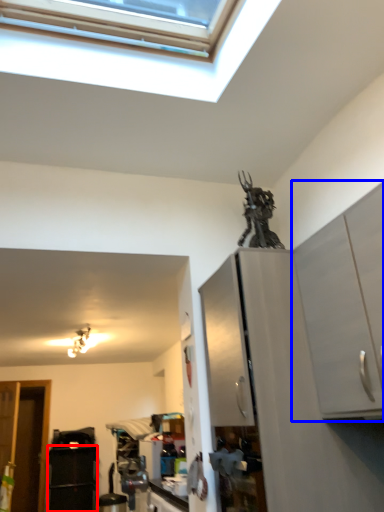
Question: Which object appears farthest to the camera in this image, appliance (highlighted by a red box) or cabinetry (highlighted by a blue box)?

Choices:
 (A) appliance
 (B) cabinetry

Answer: (A)